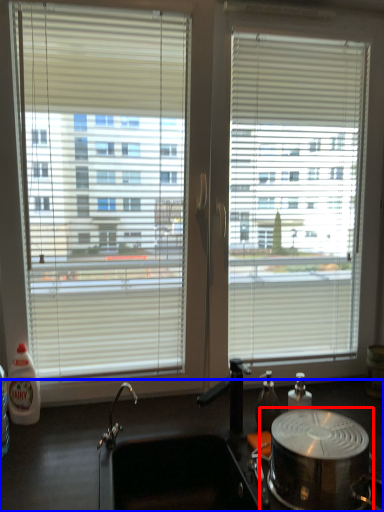
Question: Which object appears farthest to the camera in this image, appliance (highlighted by a red box) or counter top (highlighted by a blue box)?

Choices:
 (A) appliance
 (B) counter top

Answer: (A)